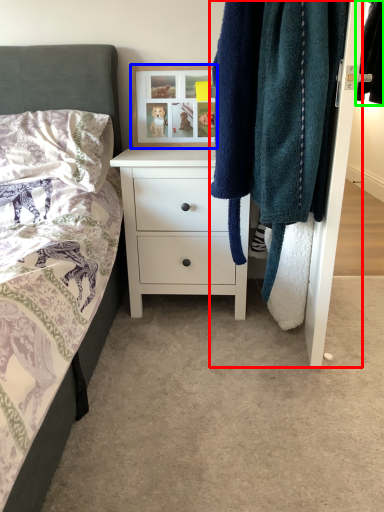
Question: Which is farther away from closet (highlighted by a red box)? picture frame (highlighted by a blue box) or clothing (highlighted by a green box)?

Choices:
 (A) picture frame
 (B) clothing

Answer: (A)